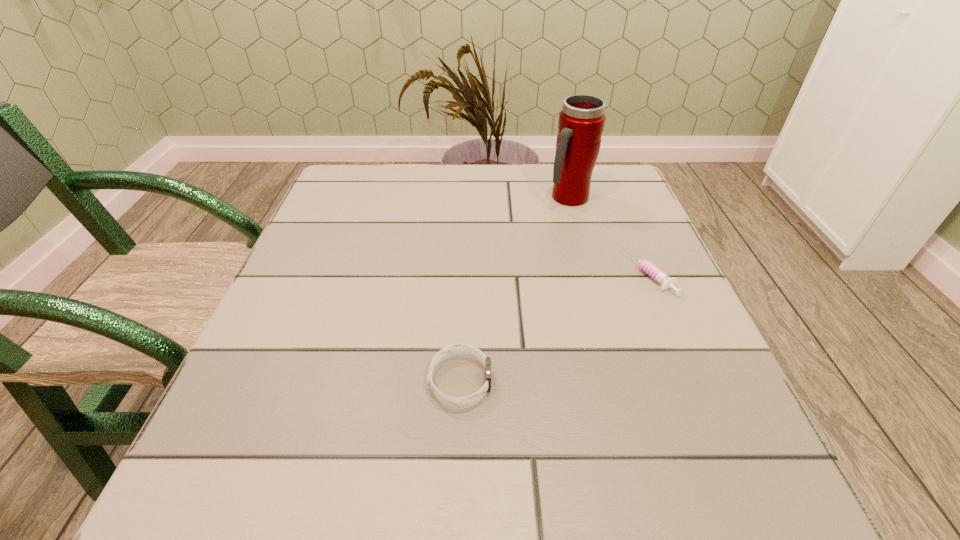
You are a GUI agent. You are given a task and a screenshot of the screen. Output one action in this format:
    pyautogui.click(x=<x>, y=<y>)
    Task: Click on the thermos bottle that is positioned at the right edge
    
    Given the screenshot: What is the action you would take?
    (x=581, y=122)

At what (x,y) coordinates should I click in order to perform the action: click on syringe present at the right edge. Please return your answer as a coordinate pair (x, y). Looking at the image, I should click on (664, 280).

Find the location of a particular element. object that is at the far right corner is located at coordinates (581, 122).

You are a GUI agent. You are given a task and a screenshot of the screen. Output one action in this format:
    pyautogui.click(x=<x>, y=<y>)
    Task: Click on the vacant space at the far edge of the desktop
    This screenshot has width=960, height=540.
    Given the screenshot: What is the action you would take?
    pyautogui.click(x=444, y=179)

Locate an element on the screen. free region at the near edge is located at coordinates pos(516,454).

The image size is (960, 540). In order to click on free point at the left edge in this screenshot , I will do `click(354, 256)`.

Find the location of a particular element. vacant space at the right edge of the desktop is located at coordinates (673, 337).

The image size is (960, 540). I want to click on vacant area at the far left corner of the desktop, so click(333, 186).

Where is `vacant space at the far right corner of the desktop`? vacant space at the far right corner of the desktop is located at coordinates (616, 195).

Where is `vacant region between the nearest object and the farthest object`? The image size is (960, 540). vacant region between the nearest object and the farthest object is located at coordinates (515, 289).